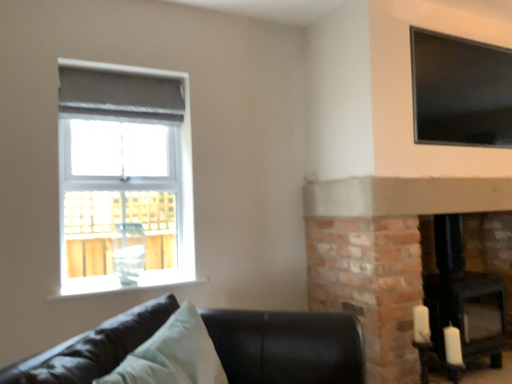
Question: From a real-world perspective, is black leather couch at lower left physically below light blue fabric pillow at lower left?

Choices:
 (A) no
 (B) yes

Answer: (B)

Question: Is black leather couch at lower left to the right of light blue fabric pillow at lower left from the viewer's perspective?

Choices:
 (A) no
 (B) yes

Answer: (B)

Question: From the image's perspective, is black leather couch at lower left under light blue fabric pillow at lower left?

Choices:
 (A) yes
 (B) no

Answer: (A)

Question: Considering the relative sizes of black leather couch at lower left and light blue fabric pillow at lower left in the image provided, is black leather couch at lower left shorter than light blue fabric pillow at lower left?

Choices:
 (A) yes
 (B) no

Answer: (B)

Question: Would you say black leather couch at lower left is outside light blue fabric pillow at lower left?

Choices:
 (A) no
 (B) yes

Answer: (B)

Question: Can you confirm if black leather couch at lower left is taller than light blue fabric pillow at lower left?

Choices:
 (A) yes
 (B) no

Answer: (A)

Question: Is matte gray roller blind at upper left, which is the 2th window in right-to-left order, aimed at black leather couch at lower left?

Choices:
 (A) yes
 (B) no

Answer: (A)

Question: Considering the relative sizes of matte gray roller blind at upper left, which is the 2th window in right-to-left order, and black leather couch at lower left in the image provided, is matte gray roller blind at upper left, which is the 2th window in right-to-left order, thinner than black leather couch at lower left?

Choices:
 (A) no
 (B) yes

Answer: (B)

Question: Is matte gray roller blind at upper left, which is the 2th window in right-to-left order, wider than black leather couch at lower left?

Choices:
 (A) no
 (B) yes

Answer: (A)

Question: From a real-world perspective, is matte gray roller blind at upper left, the first window positioned from the left, positioned over black leather couch at lower left based on gravity?

Choices:
 (A) yes
 (B) no

Answer: (A)

Question: Is matte gray roller blind at upper left, which is the 2th window in right-to-left order, far from black leather couch at lower left?

Choices:
 (A) no
 (B) yes

Answer: (B)

Question: Considering the relative positions of matte gray roller blind at upper left, the first window positioned from the left, and black leather couch at lower left in the image provided, is matte gray roller blind at upper left, the first window positioned from the left, to the right of black leather couch at lower left from the viewer's perspective?

Choices:
 (A) yes
 (B) no

Answer: (B)

Question: Is there a large distance between matte gray roller blind at upper left, which is the 2th window in right-to-left order, and black matte fireplace at lower right?

Choices:
 (A) yes
 (B) no

Answer: (A)